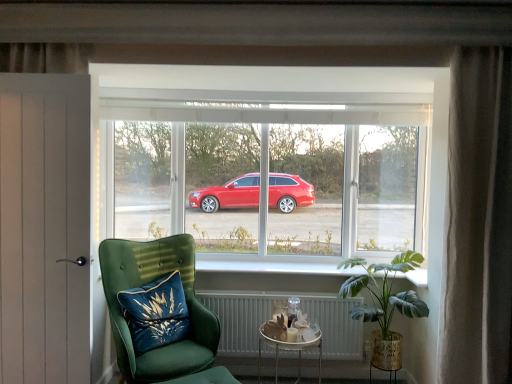
Question: Is silky beige curtain at right thinner than white metallic radiator at lower center?

Choices:
 (A) yes
 (B) no

Answer: (B)

Question: Can you see silky beige curtain at right touching white metallic radiator at lower center?

Choices:
 (A) no
 (B) yes

Answer: (A)

Question: From the image's perspective, would you say silky beige curtain at right is positioned over white metallic radiator at lower center?

Choices:
 (A) no
 (B) yes

Answer: (B)

Question: Is silky beige curtain at right located outside white metallic radiator at lower center?

Choices:
 (A) yes
 (B) no

Answer: (A)

Question: Is silky beige curtain at right positioned far away from white metallic radiator at lower center?

Choices:
 (A) yes
 (B) no

Answer: (A)

Question: Does silky beige curtain at right appear on the left side of white metallic radiator at lower center?

Choices:
 (A) no
 (B) yes

Answer: (A)

Question: Is green leafy plant at lower right to the right of white glossy window sill at center from the viewer's perspective?

Choices:
 (A) yes
 (B) no

Answer: (A)

Question: Are green leafy plant at lower right and white glossy window sill at center making contact?

Choices:
 (A) yes
 (B) no

Answer: (B)

Question: Does green leafy plant at lower right have a greater height compared to white glossy window sill at center?

Choices:
 (A) no
 (B) yes

Answer: (B)

Question: Is green leafy plant at lower right thinner than white glossy window sill at center?

Choices:
 (A) yes
 (B) no

Answer: (B)

Question: From the image's perspective, would you say green leafy plant at lower right is positioned over white glossy window sill at center?

Choices:
 (A) yes
 (B) no

Answer: (B)

Question: Does green leafy plant at lower right appear on the left side of white glossy window sill at center?

Choices:
 (A) yes
 (B) no

Answer: (B)

Question: Considering the relative sizes of transparent glass window at center and blue velvet cushion at lower left in the image provided, is transparent glass window at center thinner than blue velvet cushion at lower left?

Choices:
 (A) no
 (B) yes

Answer: (B)